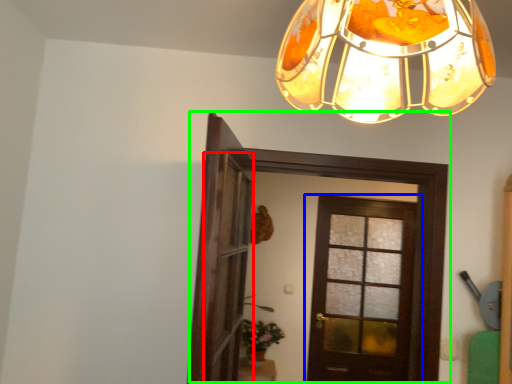
Question: Considering the real-world distances, which object is farthest from screen door (highlighted by a red box)? door (highlighted by a blue box) or door (highlighted by a green box)?

Choices:
 (A) door
 (B) door

Answer: (A)